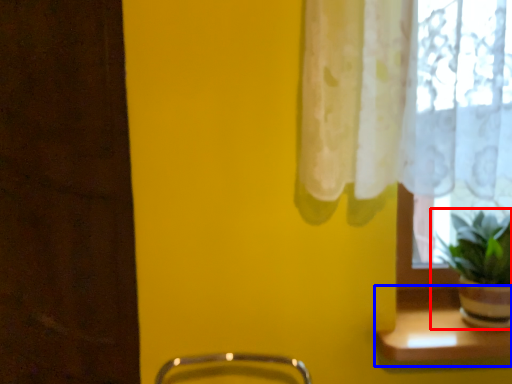
Question: Which point is closer to the camera, houseplant (highlighted by a red box) or window sill (highlighted by a blue box)?

Choices:
 (A) houseplant
 (B) window sill

Answer: (A)